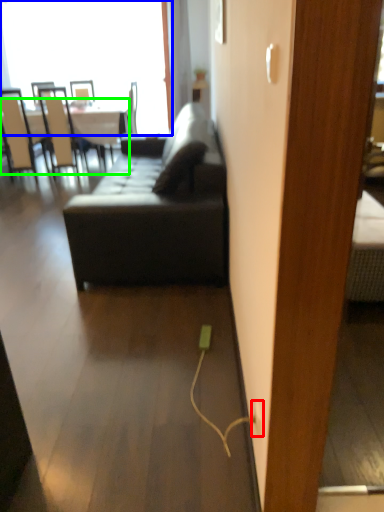
Question: Considering the real-world distances, which object is farthest from electric outlet (highlighted by a red box)? window (highlighted by a blue box) or table (highlighted by a green box)?

Choices:
 (A) window
 (B) table

Answer: (A)